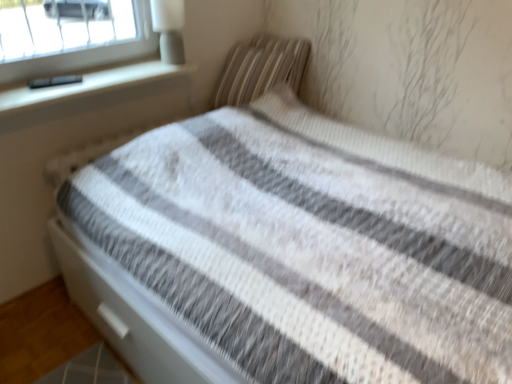
The width and height of the screenshot is (512, 384). What are the coordinates of `striped fabric pillow at upper right` in the screenshot? It's located at [260, 68].

What do you see at coordinates (260, 68) in the screenshot? I see `striped fabric pillow at upper right` at bounding box center [260, 68].

At what (x,y) coordinates should I click in order to perform the action: click on white matte lamp at upper left. Please return your answer as a coordinate pair (x, y). The image size is (512, 384). Looking at the image, I should click on (169, 29).

Describe the element at coordinates (169, 29) in the screenshot. The height and width of the screenshot is (384, 512). I see `white matte lamp at upper left` at that location.

This screenshot has height=384, width=512. In order to click on striped fabric pillow at upper right in this screenshot , I will do `click(260, 68)`.

Which is more to the right, striped fabric pillow at upper right or white matte lamp at upper left?

striped fabric pillow at upper right.

Based on the photo, is striped fabric pillow at upper right in front of or behind white matte lamp at upper left in the image?

striped fabric pillow at upper right is behind white matte lamp at upper left.

Which point is more distant from viewer, [274,64] or [168,44]?

The point [274,64] is farther from the camera.

From the image's perspective, which object appears higher, striped fabric pillow at upper right or white matte lamp at upper left?

white matte lamp at upper left appears higher in the image.

From a real-world perspective, which is physically above, striped fabric pillow at upper right or white matte lamp at upper left?

From a 3D spatial view, white matte lamp at upper left is above.

Looking at their sizes, would you say striped fabric pillow at upper right is wider or thinner than white matte lamp at upper left?

In the image, striped fabric pillow at upper right appears to be wider than white matte lamp at upper left.

Looking at this image, is striped fabric pillow at upper right taller or shorter than white matte lamp at upper left?

Considering their sizes, striped fabric pillow at upper right has more height than white matte lamp at upper left.

Between striped fabric pillow at upper right and white matte lamp at upper left, which one has larger size?

striped fabric pillow at upper right is bigger.

Does striped fabric pillow at upper right contain white matte lamp at upper left?

Definitely not — white matte lamp at upper left is not inside striped fabric pillow at upper right.

Is striped fabric pillow at upper right far from white matte lamp at upper left?

striped fabric pillow at upper right is actually quite close to white matte lamp at upper left.

Is white matte lamp at upper left at the back of striped fabric pillow at upper right?

That's not correct — striped fabric pillow at upper right is not looking away from white matte lamp at upper left.

What are the coordinates of `pillow below the white matte lamp at upper left (from a real-world perspective)` in the screenshot? It's located at (260, 68).

Consider the image. Which is more to the left, white matte lamp at upper left or striped fabric pillow at upper right?

white matte lamp at upper left is more to the left.

Does white matte lamp at upper left lie behind striped fabric pillow at upper right?

No, it is not.

Between point (161, 54) and point (264, 80), which one is positioned behind?

Positioned behind is point (264, 80).

From the image's perspective, is white matte lamp at upper left located above or below striped fabric pillow at upper right?

From the image's perspective, white matte lamp at upper left appears above striped fabric pillow at upper right.

From a real-world perspective, relative to striped fabric pillow at upper right, is white matte lamp at upper left vertically above or below?

In terms of real-world spatial position, white matte lamp at upper left is above striped fabric pillow at upper right.

Which object is thinner, white matte lamp at upper left or striped fabric pillow at upper right?

With smaller width is white matte lamp at upper left.

Is white matte lamp at upper left shorter than striped fabric pillow at upper right?

Indeed, white matte lamp at upper left has a lesser height compared to striped fabric pillow at upper right.

Between white matte lamp at upper left and striped fabric pillow at upper right, which one has larger size?

striped fabric pillow at upper right is bigger.

Would you say white matte lamp at upper left is outside striped fabric pillow at upper right?

Absolutely, white matte lamp at upper left is external to striped fabric pillow at upper right.

Based on the photo, is white matte lamp at upper left far from striped fabric pillow at upper right?

No, there isn't a large distance between white matte lamp at upper left and striped fabric pillow at upper right.

Is white matte lamp at upper left oriented away from striped fabric pillow at upper right?

No, striped fabric pillow at upper right is not at the back of white matte lamp at upper left.

The width and height of the screenshot is (512, 384). I want to click on lamp above the striped fabric pillow at upper right (from the image's perspective), so click(169, 29).

What are the coordinates of `lamp in front of the striped fabric pillow at upper right` in the screenshot? It's located at (169, 29).

Where is `pillow behind the white matte lamp at upper left`? This screenshot has height=384, width=512. pillow behind the white matte lamp at upper left is located at coordinates [260, 68].